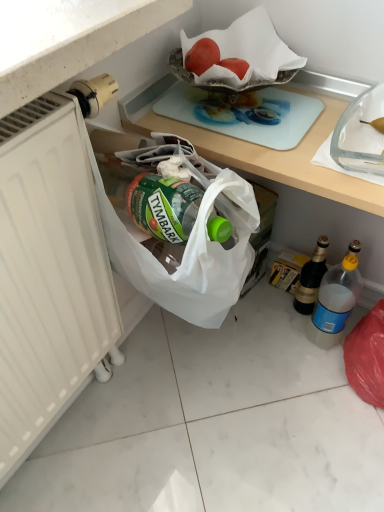
This screenshot has width=384, height=512. Find the location of `white matte radiator at left`. white matte radiator at left is located at coordinates (48, 274).

Image resolution: width=384 pixels, height=512 pixels. What do you see at coordinates (122, 395) in the screenshot? I see `white matte tile at lower left` at bounding box center [122, 395].

This screenshot has height=512, width=384. What do you see at coordinates (311, 278) in the screenshot?
I see `dark brown glass bottle at lower right, which is the second bottle in front-to-back order` at bounding box center [311, 278].

The height and width of the screenshot is (512, 384). Identify the location of light blue glass cutting board at upper center. (244, 113).

Find the location of a particular element. This screenshot has height=512, width=384. blue plastic bottle at lower right, the first bottle viewed from the front is located at coordinates (335, 300).

Considering the relative sizes of white matte tile at lower left and white matte radiator at left in the image provided, is white matte tile at lower left taller than white matte radiator at left?

Result: No.

Based on their sizes in the image, would you say white matte tile at lower left is bigger or smaller than white matte radiator at left?

In the image, white matte tile at lower left appears to be smaller than white matte radiator at left.

From a real-world perspective, does white matte tile at lower left sit lower than white matte radiator at left?

Correct, in the physical world, white matte tile at lower left is lower than white matte radiator at left.

How different are the orientations of light blue glass cutting board at upper center and dark brown glass bottle at lower right, which is the second bottle in front-to-back order, in degrees?

The angular difference between light blue glass cutting board at upper center and dark brown glass bottle at lower right, which is the second bottle in front-to-back order, is 1.21 degrees.

Does light blue glass cutting board at upper center have a lesser height compared to dark brown glass bottle at lower right, the first bottle positioned from the back?

Yes.

Is light blue glass cutting board at upper center not close to dark brown glass bottle at lower right, which is the second bottle in front-to-back order?

No, light blue glass cutting board at upper center is not far away from dark brown glass bottle at lower right, which is the second bottle in front-to-back order.

Is light blue glass cutting board at upper center closer to the viewer compared to dark brown glass bottle at lower right, which is the second bottle in front-to-back order?

Yes, light blue glass cutting board at upper center is closer to the camera.

Which of these two, red matte tomato at upper center or blue plastic bottle at lower right, acting as the 2th bottle starting from the back, stands taller?

With more height is blue plastic bottle at lower right, acting as the 2th bottle starting from the back.

Is point (208, 49) positioned behind point (344, 306)?

No, it is in front of (344, 306).

The image size is (384, 512). Identify the location of fruit located above the blue plastic bottle at lower right, acting as the 2th bottle starting from the back (from the image's perspective). (202, 56).

Measure the distance from red matte tomato at upper center to dark brown glass bottle at lower right, the first bottle positioned from the back.

They are 23.88 inches apart.

Is red matte tomato at upper center beside dark brown glass bottle at lower right, which is the second bottle in front-to-back order?

There is a gap between red matte tomato at upper center and dark brown glass bottle at lower right, which is the second bottle in front-to-back order.

Is red matte tomato at upper center further to camera compared to dark brown glass bottle at lower right, which is the second bottle in front-to-back order?

No, red matte tomato at upper center is in front of dark brown glass bottle at lower right, which is the second bottle in front-to-back order.

From the image's perspective, would you say red matte tomato at upper center is shown under dark brown glass bottle at lower right, which is the second bottle in front-to-back order?

Actually, red matte tomato at upper center appears above dark brown glass bottle at lower right, which is the second bottle in front-to-back order, in the image.

How many degrees apart are the facing directions of white matte tile at lower left and dark brown glass bottle at lower right, the first bottle positioned from the back?

There is a 91.3-degree angle between the facing directions of white matte tile at lower left and dark brown glass bottle at lower right, the first bottle positioned from the back.

Does white matte tile at lower left have a smaller size compared to dark brown glass bottle at lower right, which is the second bottle in front-to-back order?

No.

Would you say white matte tile at lower left is to the left or to the right of dark brown glass bottle at lower right, the first bottle positioned from the back, in the picture?

In the image, white matte tile at lower left appears on the left side of dark brown glass bottle at lower right, the first bottle positioned from the back.

From the image's perspective, between white matte tile at lower left and dark brown glass bottle at lower right, the first bottle positioned from the back, who is located below?

white matte tile at lower left, from the image's perspective.

How much distance is there between dark brown glass bottle at lower right, which is the second bottle in front-to-back order, and light blue glass cutting board at upper center?

dark brown glass bottle at lower right, which is the second bottle in front-to-back order, and light blue glass cutting board at upper center are 18.07 inches apart.

From a real-world perspective, is dark brown glass bottle at lower right, the first bottle positioned from the back, physically below light blue glass cutting board at upper center?

Yes, from a real-world perspective, dark brown glass bottle at lower right, the first bottle positioned from the back, is below light blue glass cutting board at upper center.

Is light blue glass cutting board at upper center located within dark brown glass bottle at lower right, the first bottle positioned from the back?

Actually, light blue glass cutting board at upper center is outside dark brown glass bottle at lower right, the first bottle positioned from the back.

Would you say dark brown glass bottle at lower right, which is the second bottle in front-to-back order, is to the left or to the right of light blue glass cutting board at upper center in the picture?

In the image, dark brown glass bottle at lower right, which is the second bottle in front-to-back order, appears on the right side of light blue glass cutting board at upper center.

Can you confirm if blue plastic bottle at lower right, the first bottle viewed from the front, is positioned to the right of red matte tomato at upper center?

Yes.

Would you say red matte tomato at upper center is part of blue plastic bottle at lower right, the first bottle viewed from the front,'s contents?

Definitely not — red matte tomato at upper center is not inside blue plastic bottle at lower right, the first bottle viewed from the front.

Is blue plastic bottle at lower right, the first bottle viewed from the front, aimed at red matte tomato at upper center?

No, blue plastic bottle at lower right, the first bottle viewed from the front, does not turn towards red matte tomato at upper center.

Can you confirm if blue plastic bottle at lower right, the first bottle viewed from the front, is wider than red matte tomato at upper center?

Yes.

Find the location of a particular element. The width and height of the screenshot is (384, 512). radiator located on the right of white matte tile at lower left is located at coordinates (48, 274).

From the image's perspective, which bottle is the 1st one below the light blue glass cutting board at upper center? Please provide its 2D coordinates.

[(311, 278)]

Based on their spatial positions, is white matte radiator at left or blue plastic bottle at lower right, acting as the 2th bottle starting from the back, closer to light blue glass cutting board at upper center?

Among the two, white matte radiator at left is located nearer to light blue glass cutting board at upper center.

Looking at the image, which one is located closer to blue plastic bottle at lower right, the first bottle viewed from the front, white matte radiator at left or light blue glass cutting board at upper center?

Among the two, light blue glass cutting board at upper center is located nearer to blue plastic bottle at lower right, the first bottle viewed from the front.

When comparing their distances from red matte tomato at upper center, does dark brown glass bottle at lower right, the first bottle positioned from the back, or white matte tile at lower left seem closer?

Among the two, dark brown glass bottle at lower right, the first bottle positioned from the back, is located nearer to red matte tomato at upper center.

Looking at the image, which one is located further to light blue glass cutting board at upper center, white matte tile at lower left or white matte radiator at left?

white matte tile at lower left lies further to light blue glass cutting board at upper center than the other object.

When comparing their distances from red matte tomato at upper center, does light blue glass cutting board at upper center or dark brown glass bottle at lower right, the first bottle positioned from the back, seem further?

dark brown glass bottle at lower right, the first bottle positioned from the back, lies further to red matte tomato at upper center than the other object.

When comparing their distances from blue plastic bottle at lower right, the first bottle viewed from the front, does white matte tile at lower left or white matte radiator at left seem closer?

Among the two, white matte tile at lower left is located nearer to blue plastic bottle at lower right, the first bottle viewed from the front.

Based on their spatial positions, is red matte tomato at upper center or dark brown glass bottle at lower right, the first bottle positioned from the back, further from light blue glass cutting board at upper center?

dark brown glass bottle at lower right, the first bottle positioned from the back, is further to light blue glass cutting board at upper center.

Looking at this image, considering their positions, is white matte radiator at left positioned further to blue plastic bottle at lower right, the first bottle viewed from the front, than dark brown glass bottle at lower right, which is the second bottle in front-to-back order?

Among the two, white matte radiator at left is located further to blue plastic bottle at lower right, the first bottle viewed from the front.

Locate an element on the screen. The height and width of the screenshot is (512, 384). cutting board that lies between red matte tomato at upper center and blue plastic bottle at lower right, the first bottle viewed from the front, from top to bottom is located at coordinates (244, 113).

You are a GUI agent. You are given a task and a screenshot of the screen. Output one action in this format:
    pyautogui.click(x=<x>, y=<y>)
    Task: Click on the bottle between light blue glass cutting board at upper center and blue plastic bottle at lower right, the first bottle viewed from the front, in the up-down direction
    
    Given the screenshot: What is the action you would take?
    pyautogui.click(x=311, y=278)

I want to click on cutting board between white matte tile at lower left and blue plastic bottle at lower right, the first bottle viewed from the front, in the horizontal direction, so click(x=244, y=113).

Where is `bottle that lies between red matte tomato at upper center and blue plastic bottle at lower right, acting as the 2th bottle starting from the back, from top to bottom`? This screenshot has height=512, width=384. bottle that lies between red matte tomato at upper center and blue plastic bottle at lower right, acting as the 2th bottle starting from the back, from top to bottom is located at coordinates (311, 278).